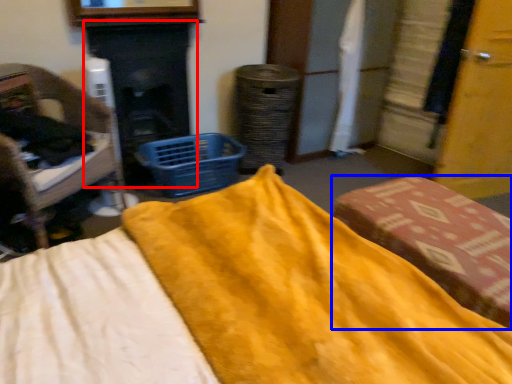
Question: Which of the following is the closest to the observer, fireplace (highlighted by a red box) or furniture (highlighted by a blue box)?

Choices:
 (A) fireplace
 (B) furniture

Answer: (B)